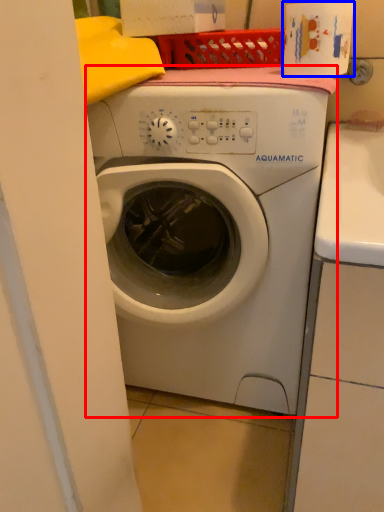
Question: Which point is further to the camera, washing machine (highlighted by a red box) or toilet paper (highlighted by a blue box)?

Choices:
 (A) washing machine
 (B) toilet paper

Answer: (B)